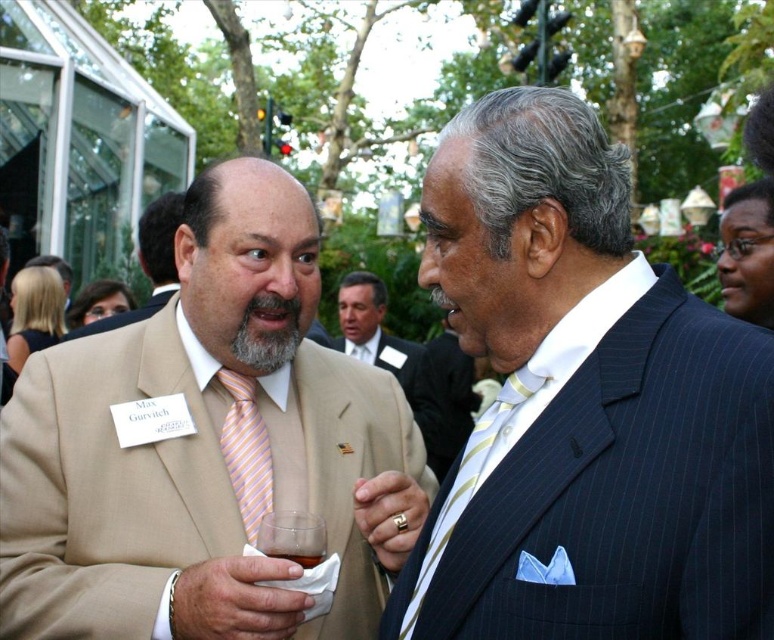
You are a photographer at this event and need to position a backdrop behind the tan fabric suit at center and the gold striped tie at center. The backdrop can only accommodate objects up to the width of the wider object. Which object determines the minimum required width of the backdrop?

The tan fabric suit at center has a greater width than the gold striped tie at center, so the backdrop must be at least as wide as the tan fabric suit at center to accommodate both.

Looking at this image, you are a photographer at this event and need to capture a photo of both the light brown suit at center and the beige fabric suit at left. Your camera has a maximum focus range of 10 feet. Can you fit both subjects within the frame without moving your position?

The distance between the light brown suit at center and the beige fabric suit at left is 9.47 feet, which is within the camera maximum focus range of 10 feet. Yes, you can fit both subjects within the frame without moving your position.